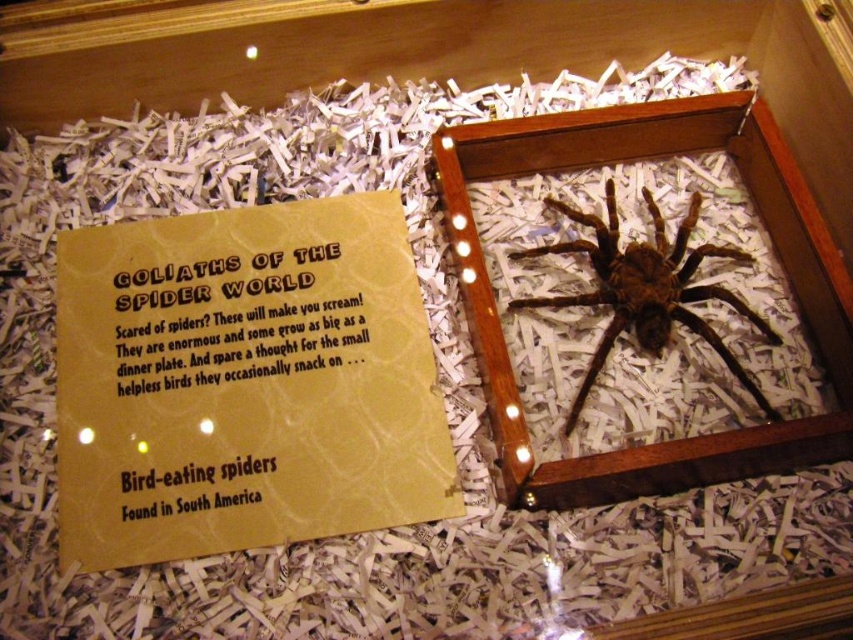
Between wooden frame at center and brown fuzzy spider at center, which one is positioned lower?

Positioned lower is brown fuzzy spider at center.

Is wooden frame at center shorter than brown fuzzy spider at center?

In fact, wooden frame at center may be taller than brown fuzzy spider at center.

Who is more distant from viewer, (845, 381) or (688, 273)?

Positioned behind is point (688, 273).

The width and height of the screenshot is (853, 640). Identify the location of wooden frame at center. (773, 253).

Does yellow paper at center have a lesser width compared to brown paper sign at upper left?

In fact, yellow paper at center might be wider than brown paper sign at upper left.

Is yellow paper at center smaller than brown paper sign at upper left?

No.

Find the location of `yellow paper at center`. yellow paper at center is located at coordinates (244, 381).

At what (x,y) coordinates should I click in order to perform the action: click on yellow paper at center. Please return your answer as a coordinate pair (x, y). Looking at the image, I should click on pyautogui.click(x=244, y=381).

Is wooden frame at center shorter than brown paper sign at upper left?

No.

Between wooden frame at center and brown paper sign at upper left, which one is positioned higher?

wooden frame at center

This screenshot has height=640, width=853. What do you see at coordinates (773, 253) in the screenshot? I see `wooden frame at center` at bounding box center [773, 253].

I want to click on wooden frame at center, so click(773, 253).